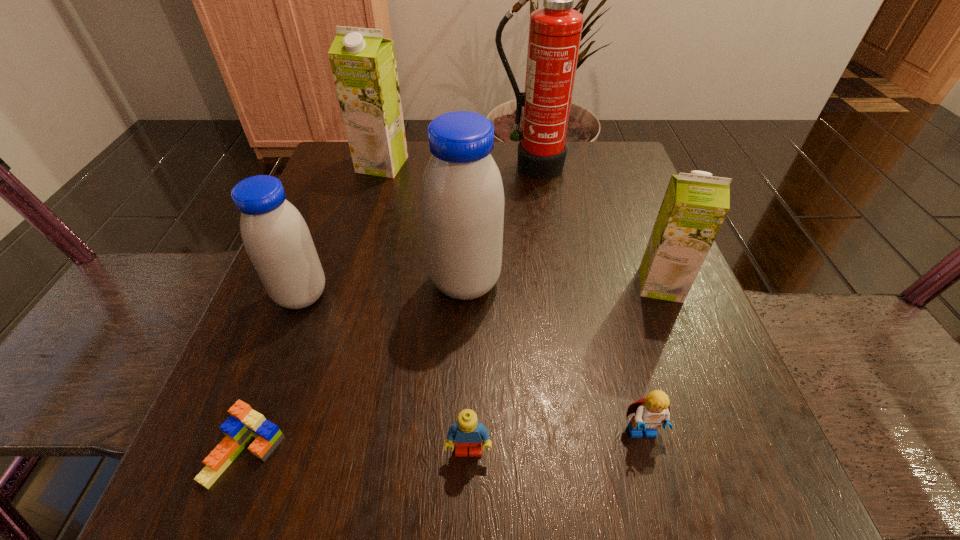
This screenshot has height=540, width=960. I want to click on fire extinguisher, so click(x=555, y=30).

You are a GUI agent. You are given a task and a screenshot of the screen. Output one action in this format:
    pyautogui.click(x=<x>, y=<y>)
    Task: Click on the tallest object
    
    Given the screenshot: What is the action you would take?
    pyautogui.click(x=555, y=30)

Find the location of `the bigger blue soya milk`. the bigger blue soya milk is located at coordinates 462,198.

Locate an element on the screen. the second soya milk from right to left is located at coordinates (462, 198).

At what (x,y) coordinates should I click in order to perform the action: click on the left green soya milk. Please return your answer as a coordinate pair (x, y). The image size is (960, 540). Looking at the image, I should click on (363, 63).

Identify the location of the farthest soya milk. This screenshot has height=540, width=960. (363, 63).

Locate an element on the screen. This screenshot has height=540, width=960. the left blue soya milk is located at coordinates (276, 237).

Locate an element on the screen. The image size is (960, 540). the right green soya milk is located at coordinates click(x=695, y=205).

Where is `the rightmost soya milk`? The width and height of the screenshot is (960, 540). the rightmost soya milk is located at coordinates [x=695, y=205].

Identify the location of blue Lego. Image resolution: width=960 pixels, height=540 pixels. (467, 432).